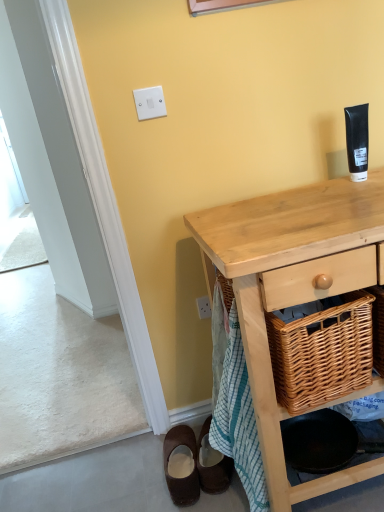
You are a GUI agent. You are given a task and a screenshot of the screen. Output one action in this format:
    pyautogui.click(x=<x>, y=<y>)
    Task: Click on the natural wood desk at center
    
    Given the screenshot: What is the action you would take?
    pyautogui.click(x=291, y=287)

The height and width of the screenshot is (512, 384). Identify the location of woven wood picnic basket at lower right. (321, 351).

Image resolution: width=384 pixels, height=512 pixels. What do you see at coordinates (149, 103) in the screenshot?
I see `white plastic light switch at upper center` at bounding box center [149, 103].

You are a GUI agent. You are given a task and a screenshot of the screen. Output one action in this format:
    pyautogui.click(x=<x>, y=<y>)
    Task: Click on the black matte tube at upper right
    
    Given the screenshot: What is the action you would take?
    pyautogui.click(x=357, y=141)

This screenshot has width=384, height=512. What do you see at coordinates (187, 476) in the screenshot?
I see `brown suede mule at lower left, arranged as the 1th footwear when viewed from the left` at bounding box center [187, 476].

Where is `natural wood desk at center`? natural wood desk at center is located at coordinates (291, 287).

At what (x,y) coordinates should I click in order to perform the action: click on desk in front of the woven wood picnic basket at lower right. Please return your answer as a coordinate pair (x, y). Looking at the image, I should click on (291, 287).

Which of these two, woven wood picnic basket at lower right or natural wood desk at center, is wider?

With larger width is natural wood desk at center.

Is woven wood picnic basket at lower right far away from natural wood desk at center?

No, woven wood picnic basket at lower right is not far away from natural wood desk at center.

Can you tell me how much black matte tube at upper right and white plastic light switch at upper center differ in facing direction?

0.958 degrees.

From the image's perspective, is black matte tube at upper right located beneath white plastic light switch at upper center?

Correct, black matte tube at upper right appears lower than white plastic light switch at upper center in the image.

Is point (358, 144) closer or farther from the camera than point (159, 108)?

Point (358, 144) is closer to the camera than point (159, 108).

Does black matte tube at upper right have a lesser width compared to white plastic light switch at upper center?

No, black matte tube at upper right is not thinner than white plastic light switch at upper center.

From a real-world perspective, is brown suede mule at lower left, the 2th footwear when ordered from right to left, physically located above or below white plastic light switch at upper center?

From a real-world perspective, brown suede mule at lower left, the 2th footwear when ordered from right to left, is physically below white plastic light switch at upper center.

Can you confirm if brown suede mule at lower left, the 2th footwear when ordered from right to left, is taller than white plastic light switch at upper center?

Correct, brown suede mule at lower left, the 2th footwear when ordered from right to left, is much taller as white plastic light switch at upper center.

Considering the sizes of objects brown suede mule at lower left, the 2th footwear when ordered from right to left, and white plastic light switch at upper center in the image provided, who is smaller, brown suede mule at lower left, the 2th footwear when ordered from right to left, or white plastic light switch at upper center?

white plastic light switch at upper center.

Is point (172, 448) closer or farther from the camera than point (156, 103)?

Point (172, 448) appears to be farther away from the viewer than point (156, 103).

Find the location of a particular element. The width and height of the screenshot is (384, 512). light switch that appears on the left of brown suede shoes at lower left, placed as the 2th footwear when sorted from left to right is located at coordinates (149, 103).

Which of these two, brown suede shoes at lower left, the 1th footwear positioned from the right, or white plastic light switch at upper center, stands taller?

With more height is brown suede shoes at lower left, the 1th footwear positioned from the right.

From a real-world perspective, is brown suede shoes at lower left, placed as the 2th footwear when sorted from left to right, positioned above or below white plastic light switch at upper center?

Clearly, from a real-world perspective, brown suede shoes at lower left, placed as the 2th footwear when sorted from left to right, is below white plastic light switch at upper center.

Is brown suede shoes at lower left, placed as the 2th footwear when sorted from left to right, inside or outside of white plastic light switch at upper center?

brown suede shoes at lower left, placed as the 2th footwear when sorted from left to right, is spatially situated outside white plastic light switch at upper center.

From the image's perspective, is natural wood desk at center over white plastic light switch at upper center?

Actually, natural wood desk at center appears below white plastic light switch at upper center in the image.

Considering the points (354, 393) and (152, 87), which point is behind, point (354, 393) or point (152, 87)?

The point (152, 87) is farther from the camera.

In terms of size, does natural wood desk at center appear bigger or smaller than white plastic light switch at upper center?

Clearly, natural wood desk at center is larger in size than white plastic light switch at upper center.

From a real-world perspective, which object stands above the other?

white plastic light switch at upper center is physically above.

Is natural wood desk at center thinner than brown suede shoes at lower left, the 1th footwear positioned from the right?

No.

Is natural wood desk at center not close to brown suede shoes at lower left, placed as the 2th footwear when sorted from left to right?

Actually, natural wood desk at center and brown suede shoes at lower left, placed as the 2th footwear when sorted from left to right, are a little close together.

From the image's perspective, between natural wood desk at center and brown suede shoes at lower left, the 1th footwear positioned from the right, which one is located above?

natural wood desk at center, from the image's perspective.

Consider the image. From a real-world perspective, is natural wood desk at center positioned above or below brown suede shoes at lower left, placed as the 2th footwear when sorted from left to right?

Clearly, from a real-world perspective, natural wood desk at center is above brown suede shoes at lower left, placed as the 2th footwear when sorted from left to right.

Who is taller, natural wood desk at center or brown suede mule at lower left, arranged as the 1th footwear when viewed from the left?

natural wood desk at center is taller.

From the image's perspective, which one is positioned lower, natural wood desk at center or brown suede mule at lower left, the 2th footwear when ordered from right to left?

brown suede mule at lower left, the 2th footwear when ordered from right to left, is shown below in the image.

Is natural wood desk at center turned away from brown suede mule at lower left, arranged as the 1th footwear when viewed from the left?

No.

Locate an element on the screen. Image resolution: width=384 pixels, height=512 pixels. desk that is on the right side of woven wood picnic basket at lower right is located at coordinates (291, 287).

The height and width of the screenshot is (512, 384). I want to click on toiletry below the white plastic light switch at upper center (from the image's perspective), so click(x=357, y=141).

Which object lies nearer to the anchor point white plastic light switch at upper center, black matte tube at upper right or woven wood picnic basket at lower right?

Based on the image, black matte tube at upper right appears to be nearer to white plastic light switch at upper center.

Which object lies further to the anchor point woven wood picnic basket at lower right, white plastic light switch at upper center or natural wood desk at center?

white plastic light switch at upper center is positioned further to the anchor woven wood picnic basket at lower right.

When comparing their distances from natural wood desk at center, does brown suede shoes at lower left, placed as the 2th footwear when sorted from left to right, or white plastic light switch at upper center seem closer?

brown suede shoes at lower left, placed as the 2th footwear when sorted from left to right, is positioned closer to the anchor natural wood desk at center.

Based on their spatial positions, is natural wood desk at center or woven wood picnic basket at lower right further from black matte tube at upper right?

woven wood picnic basket at lower right.

Considering their positions, is white plastic light switch at upper center positioned closer to brown suede mule at lower left, the 2th footwear when ordered from right to left, than black matte tube at upper right?

black matte tube at upper right is positioned closer to the anchor brown suede mule at lower left, the 2th footwear when ordered from right to left.

Estimate the real-world distances between objects in this image. Which object is further from brown suede mule at lower left, arranged as the 1th footwear when viewed from the left, white plastic light switch at upper center or woven wood picnic basket at lower right?

The object further to brown suede mule at lower left, arranged as the 1th footwear when viewed from the left, is white plastic light switch at upper center.

Based on their spatial positions, is white plastic light switch at upper center or brown suede shoes at lower left, the 1th footwear positioned from the right, closer to black matte tube at upper right?

Based on the image, white plastic light switch at upper center appears to be nearer to black matte tube at upper right.

From the image, which object appears to be nearer to woven wood picnic basket at lower right, brown suede mule at lower left, the 2th footwear when ordered from right to left, or white plastic light switch at upper center?

brown suede mule at lower left, the 2th footwear when ordered from right to left, lies closer to woven wood picnic basket at lower right than the other object.

The height and width of the screenshot is (512, 384). I want to click on footwear between woven wood picnic basket at lower right and brown suede mule at lower left, the 2th footwear when ordered from right to left, from top to bottom, so click(x=212, y=464).

You are a GUI agent. You are given a task and a screenshot of the screen. Output one action in this format:
    pyautogui.click(x=<x>, y=<y>)
    Task: Click on the footwear between white plastic light switch at upper center and brown suede mule at lower left, arranged as the 1th footwear when viewed from the left, from top to bottom
    
    Given the screenshot: What is the action you would take?
    pyautogui.click(x=212, y=464)

The height and width of the screenshot is (512, 384). What are the coordinates of `footwear positioned between natural wood desk at center and brown suede shoes at lower left, the 1th footwear positioned from the right, from near to far` in the screenshot? It's located at (187, 476).

Where is `picnic basket between black matte tube at upper right and brown suede mule at lower left, the 2th footwear when ordered from right to left, vertically`? The height and width of the screenshot is (512, 384). picnic basket between black matte tube at upper right and brown suede mule at lower left, the 2th footwear when ordered from right to left, vertically is located at coordinates (321, 351).